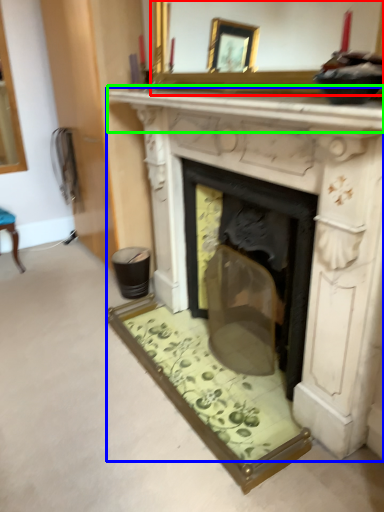
Question: Which object is the closest to the mirror (highlighted by a red box)? Choose among these: fireplace (highlighted by a blue box) or mantle (highlighted by a green box).

Choices:
 (A) fireplace
 (B) mantle

Answer: (B)